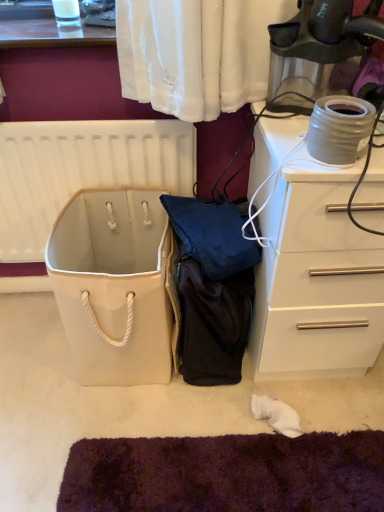
Question: Considering the relative positions of white canvas bag at center and white plastic radiator at upper left in the image provided, is white canvas bag at center to the left of white plastic radiator at upper left from the viewer's perspective?

Choices:
 (A) no
 (B) yes

Answer: (A)

Question: Would you say white canvas bag at center is outside white plastic radiator at upper left?

Choices:
 (A) yes
 (B) no

Answer: (A)

Question: Is white canvas bag at center positioned behind white plastic radiator at upper left?

Choices:
 (A) no
 (B) yes

Answer: (A)

Question: Is the depth of white canvas bag at center less than that of white plastic radiator at upper left?

Choices:
 (A) yes
 (B) no

Answer: (A)

Question: Considering the relative sizes of white canvas bag at center and white plastic radiator at upper left in the image provided, is white canvas bag at center smaller than white plastic radiator at upper left?

Choices:
 (A) no
 (B) yes

Answer: (A)

Question: From the image's perspective, is matte gray ceramic pot at upper right positioned above or below white canvas bag at center?

Choices:
 (A) below
 (B) above

Answer: (B)

Question: In terms of height, does matte gray ceramic pot at upper right look taller or shorter compared to white canvas bag at center?

Choices:
 (A) short
 (B) tall

Answer: (A)

Question: Is matte gray ceramic pot at upper right in front of or behind white canvas bag at center in the image?

Choices:
 (A) front
 (B) behind

Answer: (A)

Question: Based on their sizes in the image, would you say matte gray ceramic pot at upper right is bigger or smaller than white canvas bag at center?

Choices:
 (A) big
 (B) small

Answer: (B)

Question: Based on their positions, is white canvas bag at center located to the left or right of matte gray ceramic pot at upper right?

Choices:
 (A) left
 (B) right

Answer: (A)

Question: Would you say white canvas bag at center is inside or outside matte gray ceramic pot at upper right?

Choices:
 (A) inside
 (B) outside

Answer: (B)

Question: Is point (86, 339) positioned closer to the camera than point (365, 110)?

Choices:
 (A) farther
 (B) closer

Answer: (A)

Question: From a real-world perspective, relative to matte gray ceramic pot at upper right, is white canvas bag at center vertically above or below?

Choices:
 (A) above
 (B) below

Answer: (B)

Question: Considering the positions of white glossy chest of drawers at right and white canvas bag at center in the image, is white glossy chest of drawers at right taller or shorter than white canvas bag at center?

Choices:
 (A) tall
 (B) short

Answer: (A)

Question: From the image's perspective, is white glossy chest of drawers at right located above or below white canvas bag at center?

Choices:
 (A) above
 (B) below

Answer: (A)